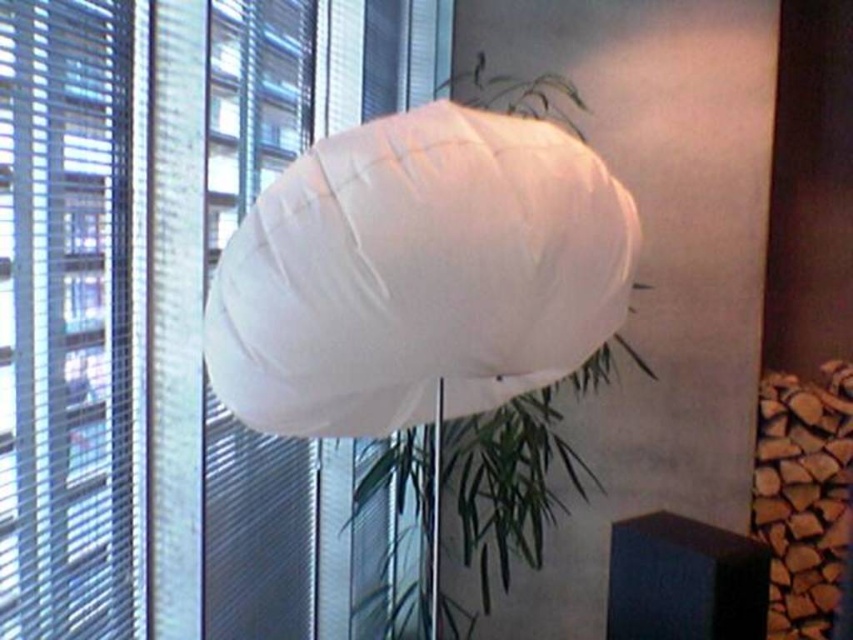
You are standing in the room and want to determine which of the two points, point (457, 173) or point (56, 154), is nearer to you. Based on the scene description, which point is closer?

Point (457, 173) is closer to the camera than point (56, 154), so it is the nearer point.

You are a window cleaner and need to clean the white matte blind at upper center and the transparent plastic blinds at left. Which blind requires a taller ladder to reach?

The white matte blind at upper center requires a taller ladder because it is much taller than the transparent plastic blinds at left.